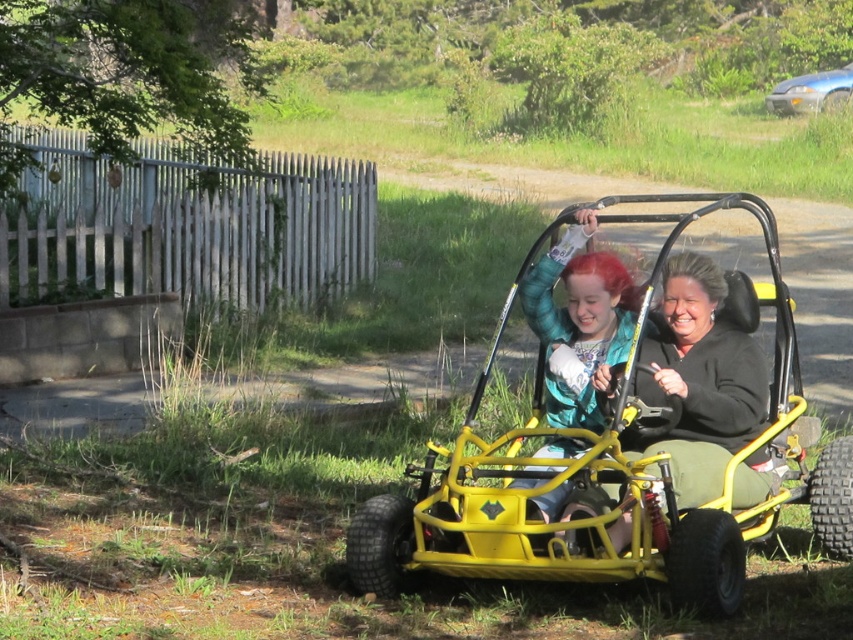
Question: Which point is farther from the camera taking this photo?

Choices:
 (A) (849, 76)
 (B) (578, 419)
 (C) (758, 413)
 (D) (616, 196)

Answer: (A)

Question: Which of these objects is positioned closest to the metallic blue sedan at upper right?

Choices:
 (A) yellow matte go-kart at center
 (B) shiny teal jacket at center

Answer: (B)

Question: Can you confirm if matte black jacket at center is positioned to the left of shiny teal jacket at center?

Choices:
 (A) no
 (B) yes

Answer: (A)

Question: Which is farther from the metallic blue sedan at upper right?

Choices:
 (A) yellow matte go-kart at center
 (B) matte black jacket at center
 (C) shiny teal jacket at center

Answer: (A)

Question: Can you confirm if matte black jacket at center is positioned above metallic blue sedan at upper right?

Choices:
 (A) yes
 (B) no

Answer: (B)

Question: From the image, what is the correct spatial relationship of shiny teal jacket at center in relation to metallic blue sedan at upper right?

Choices:
 (A) right
 (B) left

Answer: (B)